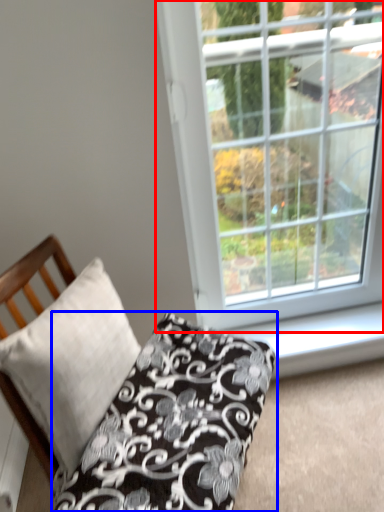
Question: Which of the following is the closest to the observer, window (highlighted by a red box) or pillow (highlighted by a blue box)?

Choices:
 (A) window
 (B) pillow

Answer: (B)